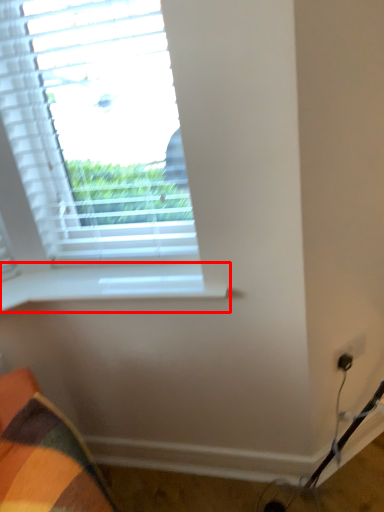
Question: From the image's perspective, where is window sill (annotated by the red box) located in relation to window in the image?

Choices:
 (A) above
 (B) below

Answer: (B)